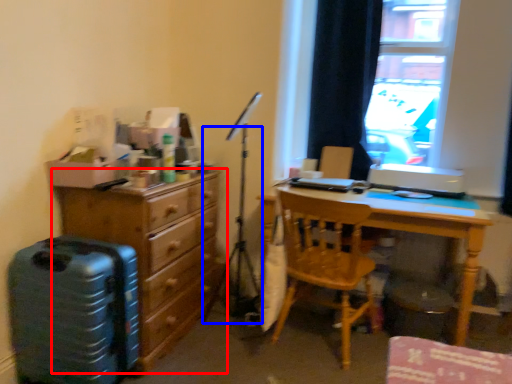
Question: Which of the following is the farthest to the observer, chest of drawers (highlighted by a red box) or tripod (highlighted by a blue box)?

Choices:
 (A) chest of drawers
 (B) tripod

Answer: (B)